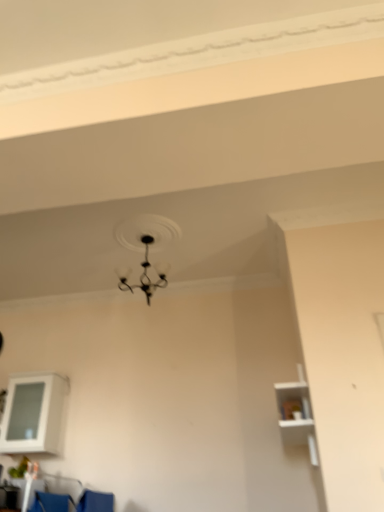
Question: Which is correct: black matte chandelier at upper center is inside white matte shelf at right, which is the first shelf in right-to-left order, or outside of it?

Choices:
 (A) inside
 (B) outside

Answer: (B)

Question: In terms of size, does black matte chandelier at upper center appear bigger or smaller than white matte shelf at right, arranged as the first shelf when viewed from the front?

Choices:
 (A) small
 (B) big

Answer: (A)

Question: Which of these objects is positioned farthest from the white glossy cabinet at lower left, which is the first shelf from back to front?

Choices:
 (A) black matte chandelier at upper center
 (B) blue fabric armchair at lower left
 (C) white matte shelf at right, the second shelf when ordered from left to right

Answer: (C)

Question: Which is farther from the black matte chandelier at upper center?

Choices:
 (A) white matte shelf at right, the 2th shelf in the back-to-front sequence
 (B) white glossy cabinet at lower left, marked as the 1th shelf in a left-to-right arrangement
 (C) blue fabric armchair at lower left

Answer: (C)